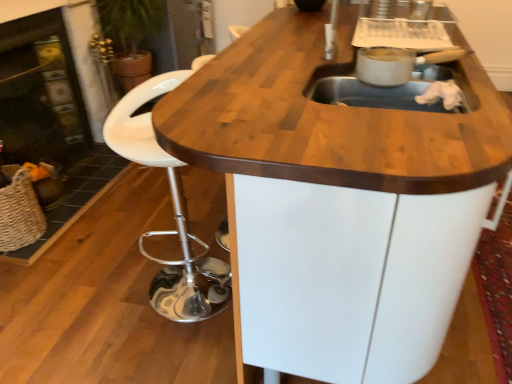
Question: From a real-world perspective, is woven straw basket at lower left above or below white plastic stool at lower left?

Choices:
 (A) above
 (B) below

Answer: (B)

Question: Is woven straw basket at lower left in front of or behind white plastic stool at lower left in the image?

Choices:
 (A) behind
 (B) front

Answer: (A)

Question: Which object is positioned farthest from the matte black fireplace at left, the 1th fireplace when ordered from left to right?

Choices:
 (A) woven straw basket at lower left
 (B) white plastic stool at lower left
 (C) black glass fireplace at left, positioned as the second fireplace in left-to-right order

Answer: (B)

Question: Estimate the real-world distances between objects in this image. Which object is closer to the woven straw basket at lower left?

Choices:
 (A) black glass fireplace at left, positioned as the second fireplace in left-to-right order
 (B) matte black fireplace at left, the second fireplace viewed from the right
 (C) white plastic stool at lower left

Answer: (A)